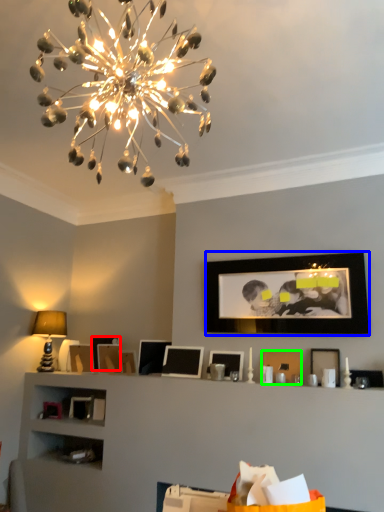
Question: Based on their relative distances, which object is nearer to picture frame (highlighted by a red box)? Choose from picture frame (highlighted by a blue box) and picture frame (highlighted by a green box).

Choices:
 (A) picture frame
 (B) picture frame

Answer: (B)